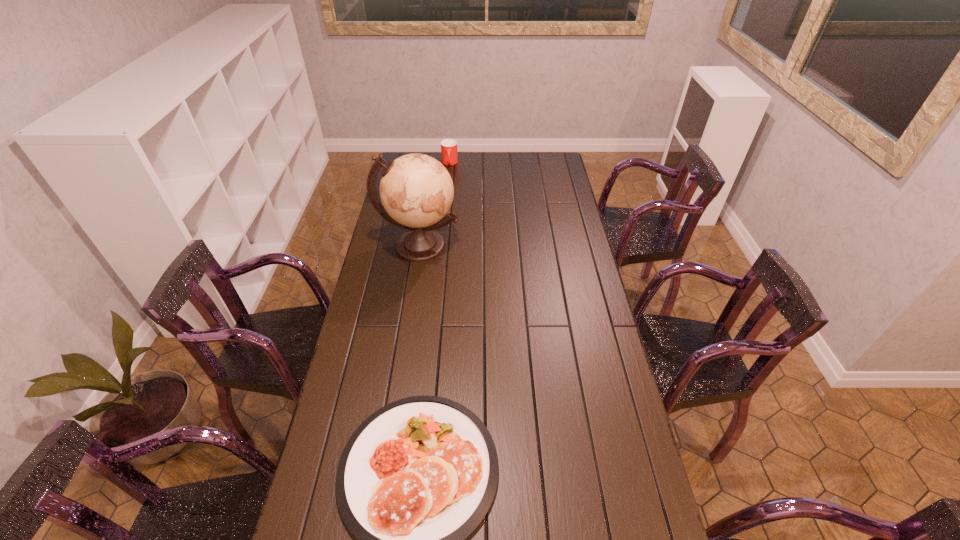
Find the location of a particular element. The width and height of the screenshot is (960, 540). the second nearest object is located at coordinates (416, 191).

This screenshot has width=960, height=540. I want to click on the tallest object, so click(416, 191).

Find the location of a particular element. cup is located at coordinates (449, 153).

Identify the location of the second shortest object. (449, 153).

Locate an element on the screen. The height and width of the screenshot is (540, 960). vacant space located on the front-facing side of the tallest object is located at coordinates (405, 331).

Find the location of `vacant point located on the side of the cup with the handle`. vacant point located on the side of the cup with the handle is located at coordinates (448, 180).

You are a GUI agent. You are given a task and a screenshot of the screen. Output one action in this format:
    pyautogui.click(x=<x>, y=<y>)
    Task: Click on the object present at the far edge
    The width and height of the screenshot is (960, 540).
    Given the screenshot: What is the action you would take?
    pyautogui.click(x=449, y=153)

This screenshot has height=540, width=960. Identify the location of object that is positioned at the left edge. (416, 191).

Identify the location of vacant space at the far edge of the desktop. This screenshot has width=960, height=540. (525, 176).

Where is `free location at the left edge`? The width and height of the screenshot is (960, 540). free location at the left edge is located at coordinates (386, 271).